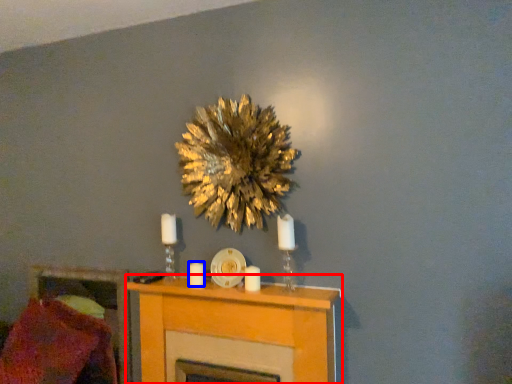
Question: Which point is closer to the camera, furniture (highlighted by a red box) or candle (highlighted by a blue box)?

Choices:
 (A) furniture
 (B) candle

Answer: (A)